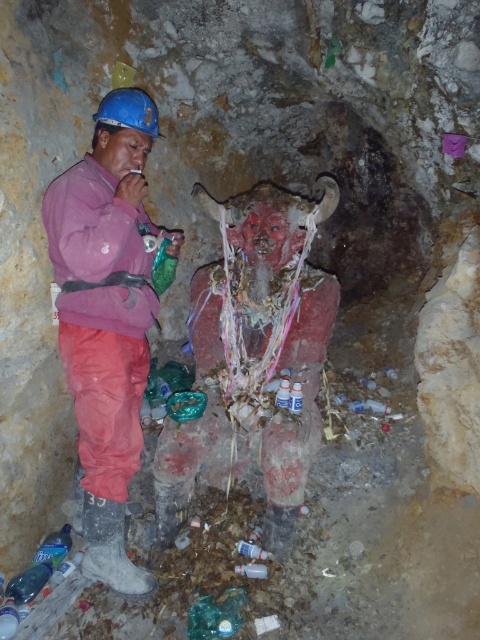
Consider the image. Does matte pink jacket at left have a smaller size compared to matte red statue at center?

No.

Is matte pink jacket at left above matte red statue at center?

Yes.

This screenshot has height=640, width=480. Find the location of `matte pink jacket at left`. matte pink jacket at left is located at coordinates (108, 320).